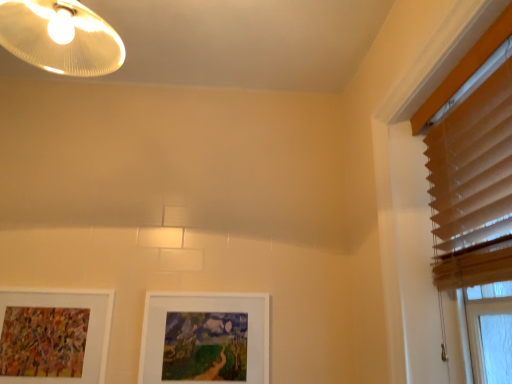
Question: Which is correct: white matte picture frame at center, the 2th picture frame in the left-to-right sequence, is inside beige wood blinds at upper right, or outside of it?

Choices:
 (A) outside
 (B) inside

Answer: (A)

Question: In terms of height, does white matte picture frame at center, acting as the first picture frame starting from the right, look taller or shorter compared to beige wood blinds at upper right?

Choices:
 (A) tall
 (B) short

Answer: (B)

Question: Considering the real-world distances, which object is closest to the white matte picture frame at center, the 2th picture frame in the left-to-right sequence?

Choices:
 (A) beige wood blinds at upper right
 (B) matte white lampshade at upper left
 (C) white matte picture frame at lower left, arranged as the first picture frame when viewed from the left

Answer: (C)

Question: Considering the real-world distances, which object is closest to the white matte picture frame at center, acting as the first picture frame starting from the right?

Choices:
 (A) matte white lampshade at upper left
 (B) white matte picture frame at lower left, marked as the second picture frame in a right-to-left arrangement
 (C) beige wood blinds at upper right

Answer: (B)